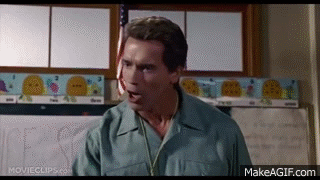
The width and height of the screenshot is (320, 180). I want to click on window, so click(221, 26), click(85, 25).